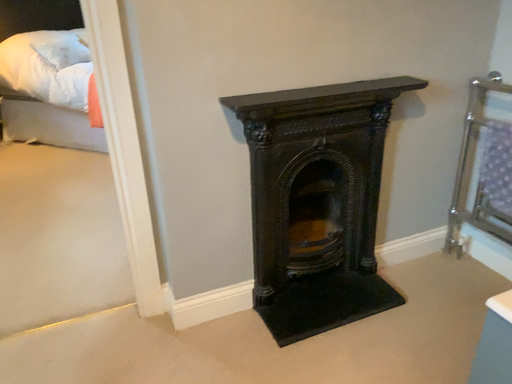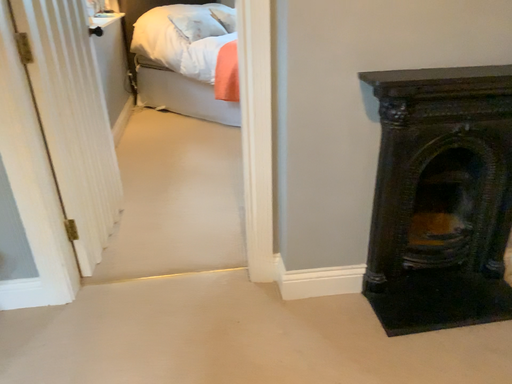
Question: Which way did the camera rotate in the video?

Choices:
 (A) rotated left
 (B) rotated right

Answer: (A)